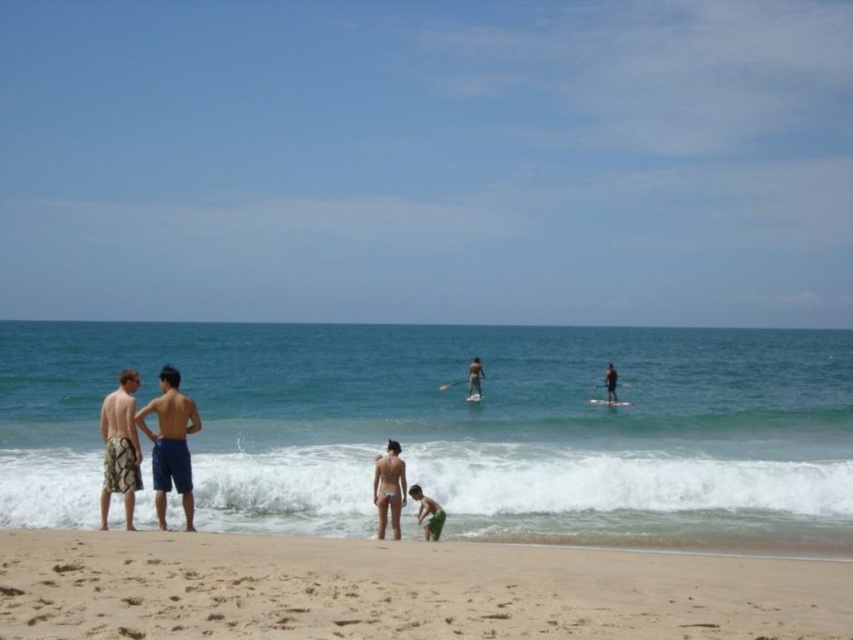
You are a photographer at the beach and want to capture both the green cotton shorts at lower center and the smooth tan surfboard at center in the same frame. Which object should you focus on first to ensure both are in the shot?

The green cotton shorts at lower center is not as tall as the smooth tan surfboard at center, so you should focus on the taller smooth tan surfboard at center first to ensure both fit in the frame.

You are a photographer at the beach and want to capture both the green cotton shorts at lower center and the smooth tan surfboard at center in the same frame. Based on their positions, can you tell which object is closer to the camera?

The green cotton shorts at lower center is positioned under the smooth tan surfboard at center, so the surfboard is closer to the camera than the shorts.